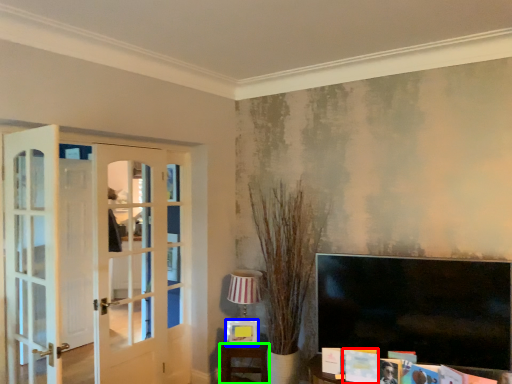
Question: Estimate the real-world distances between objects in this image. Which object is closer to magazine (highlighted by a red box), picture frame (highlighted by a blue box) or furniture (highlighted by a green box)?

Choices:
 (A) picture frame
 (B) furniture

Answer: (A)